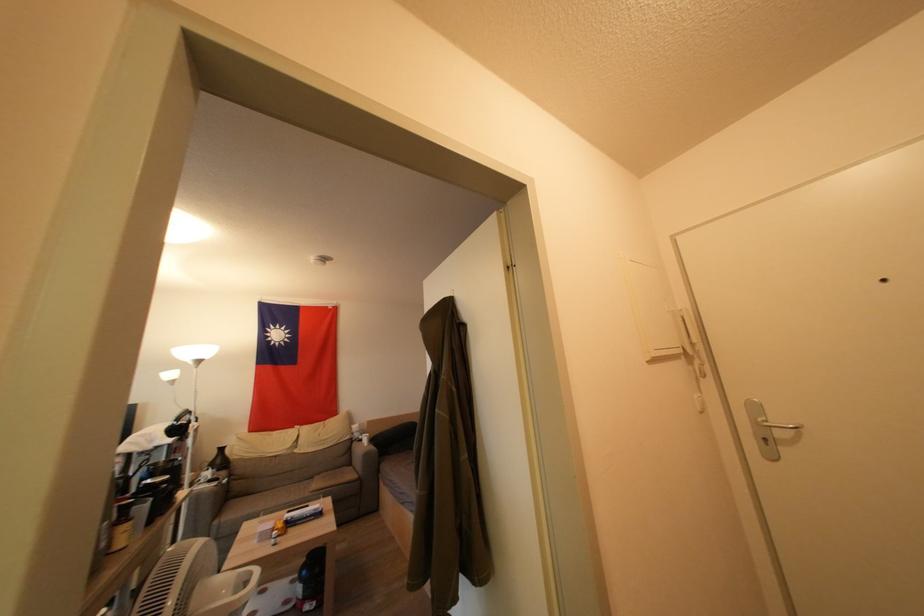
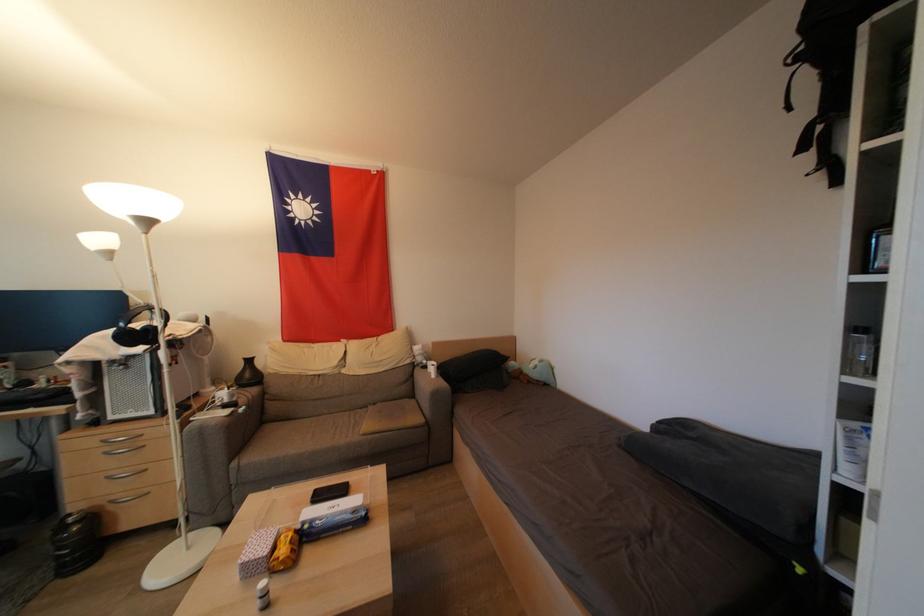
The point at (357, 445) is marked in the first image. Where is the corresponding point in the second image?

(418, 370)